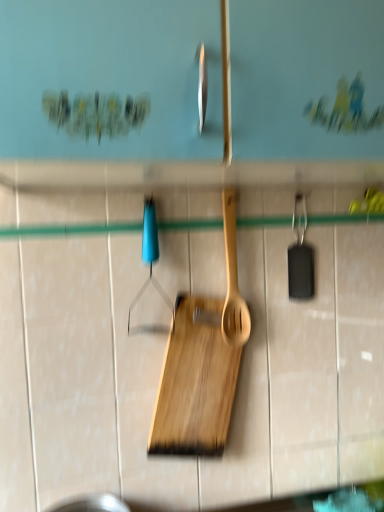
Question: Considering the relative sizes of natural wood cutting board at center and wooden spatula at center in the image provided, is natural wood cutting board at center smaller than wooden spatula at center?

Choices:
 (A) yes
 (B) no

Answer: (B)

Question: Is natural wood cutting board at center further to the viewer compared to wooden spatula at center?

Choices:
 (A) yes
 (B) no

Answer: (B)

Question: Is natural wood cutting board at center not inside wooden spatula at center?

Choices:
 (A) yes
 (B) no

Answer: (A)

Question: Considering the relative sizes of natural wood cutting board at center and wooden spatula at center in the image provided, is natural wood cutting board at center bigger than wooden spatula at center?

Choices:
 (A) yes
 (B) no

Answer: (A)

Question: From a real-world perspective, is natural wood cutting board at center physically above wooden spatula at center?

Choices:
 (A) yes
 (B) no

Answer: (B)

Question: Does natural wood cutting board at center appear on the right side of wooden spatula at center?

Choices:
 (A) yes
 (B) no

Answer: (B)

Question: From a real-world perspective, is natural wood cutting board at center under blue plastic hanger at center?

Choices:
 (A) no
 (B) yes

Answer: (B)

Question: Does natural wood cutting board at center turn towards blue plastic hanger at center?

Choices:
 (A) yes
 (B) no

Answer: (B)

Question: Can we say natural wood cutting board at center lies outside blue plastic hanger at center?

Choices:
 (A) yes
 (B) no

Answer: (A)

Question: From the image's perspective, is natural wood cutting board at center located beneath blue plastic hanger at center?

Choices:
 (A) no
 (B) yes

Answer: (B)

Question: Is natural wood cutting board at center directly adjacent to blue plastic hanger at center?

Choices:
 (A) yes
 (B) no

Answer: (B)

Question: Would you say natural wood cutting board at center contains blue plastic hanger at center?

Choices:
 (A) yes
 (B) no

Answer: (B)

Question: Is wooden spatula at center taller than blue plastic hanger at center?

Choices:
 (A) yes
 (B) no

Answer: (A)